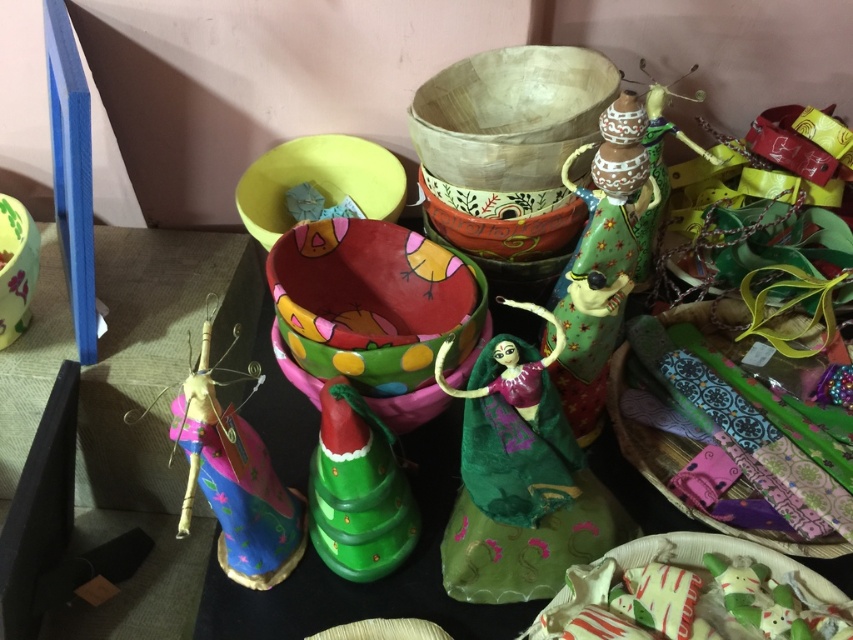
Based on the photo, you are organizing a craft fair and need to place the green painted wood at center and the textured fabric bag at right on a shelf. The shelf has a width of 1 meter. Can both items fit side by side without overlapping?

The green painted wood at center has a lesser width compared to textured fabric bag at right. However, since their combined widths are not specified, we cannot determine if they will fit on a 1 meter shelf. More information is needed about their individual widths.

You are organizing a craft display and need to place the green painted wood at center and the green matte cone at center. Based on the scene description, which object is placed above the other?

The green painted wood at center is positioned over the green matte cone at center, so the green painted wood at center is placed above the green matte cone at center.